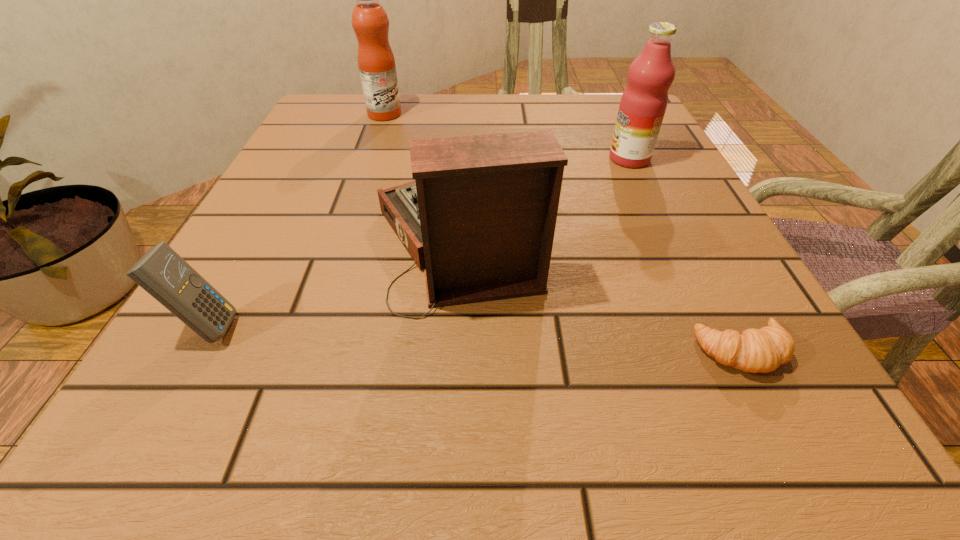
Identify the location of object that is positioned at the far left corner. (376, 62).

Identify the location of free space at the far edge of the desktop. (394, 122).

You are a GUI agent. You are given a task and a screenshot of the screen. Output one action in this format:
    pyautogui.click(x=<x>, y=<y>)
    Task: Click on the free space at the near edge of the desktop
    The width and height of the screenshot is (960, 540).
    Given the screenshot: What is the action you would take?
    pyautogui.click(x=600, y=396)

The width and height of the screenshot is (960, 540). I want to click on vacant space at the left edge of the desktop, so pos(243,251).

Where is `vacant region at the right edge of the desktop`? Image resolution: width=960 pixels, height=540 pixels. vacant region at the right edge of the desktop is located at coordinates (651, 266).

Find the location of `vacant space at the far left corner of the desktop`. vacant space at the far left corner of the desktop is located at coordinates (303, 139).

You are a GUI agent. You are given a task and a screenshot of the screen. Output one action in this format:
    pyautogui.click(x=<x>, y=<y>)
    Task: Click on the vacant space at the far right corner of the desktop
    
    Given the screenshot: What is the action you would take?
    pyautogui.click(x=594, y=131)

Find the location of `empty space between the shortest object and the left fruit juice`. empty space between the shortest object and the left fruit juice is located at coordinates (563, 233).

Find the location of a particular element. This screenshot has height=540, width=960. vacant region between the third object from left to right and the calculator is located at coordinates (333, 282).

You are a GUI agent. You are given a task and a screenshot of the screen. Output one action in this format:
    pyautogui.click(x=<x>, y=<y>)
    Task: Click on the vacant space in between the fourth tallest object and the phonograph record
    Image resolution: width=960 pixels, height=540 pixels.
    Given the screenshot: What is the action you would take?
    pyautogui.click(x=333, y=282)